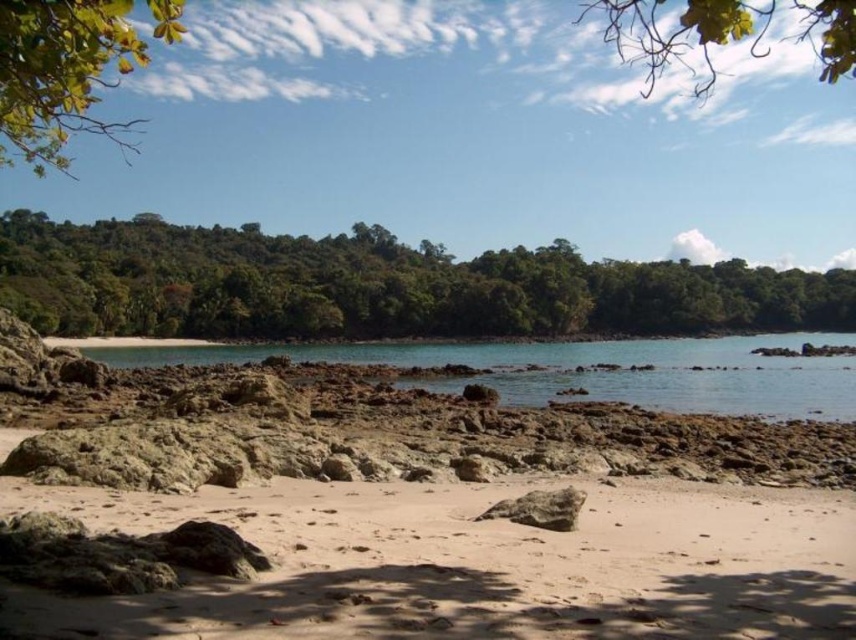
You are standing on the beach and looking towards the forest. Which green leafy tree is positioned more to your left side, the green leafy tree at upper left or the green leafy tree at upper center?

The green leafy tree at upper left is positioned more to the left side compared to the green leafy tree at upper center.